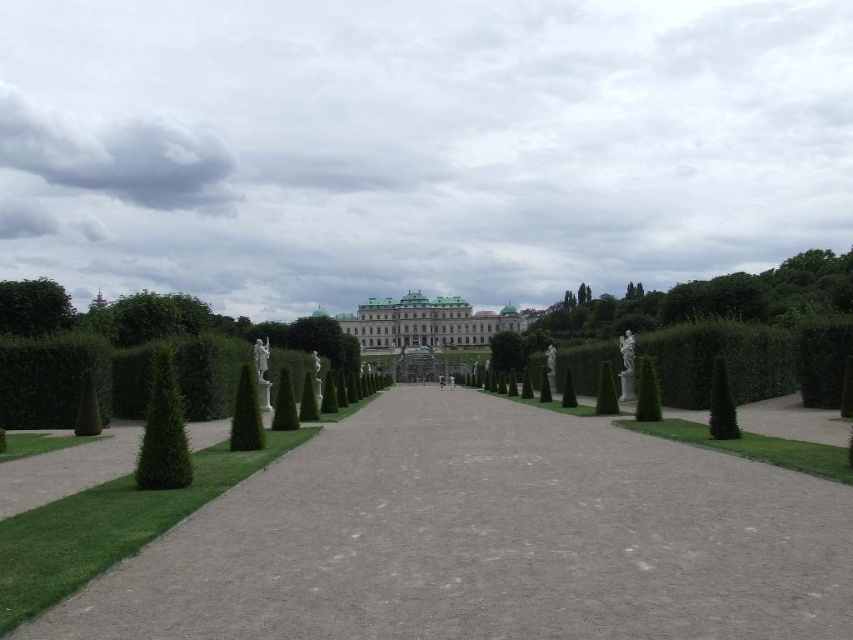
You are a visitor standing at the entrance of the garden, looking towards the building. You notice two plants at the center of the pathway. Which one is taller between the green hedge at center and the green leafy bush at center?

The green hedge at center is much taller than the green leafy bush at center.

You are a visitor standing at the entrance of the garden pathway. You notice two plants at the center of the scene. Which one is positioned higher up, the green hedge at center or the green leafy bush at center?

The green hedge at center is located above the green leafy bush at center, so the green hedge at center is positioned higher up.